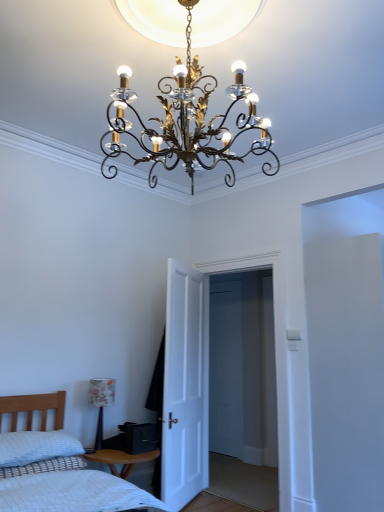
Where is `white textured pillow at lower left`? white textured pillow at lower left is located at coordinates (36, 447).

In order to click on white matte door at center in this screenshot , I will do `click(185, 387)`.

In order to click on white textured pillow at lower left in this screenshot , I will do `click(36, 447)`.

In the scene shown: Which of these two, white textured pillow at lower left or floral-patterned fabric lampshade at lower left, the 1th lamp viewed from the left, stands shorter?

Standing shorter between the two is white textured pillow at lower left.

Could you measure the distance between white textured pillow at lower left and floral-patterned fabric lampshade at lower left, the 1th lamp positioned from the back?

white textured pillow at lower left and floral-patterned fabric lampshade at lower left, the 1th lamp positioned from the back, are 56.08 centimeters apart from each other.

Is white textured pillow at lower left not near floral-patterned fabric lampshade at lower left, the 1th lamp viewed from the left?

white textured pillow at lower left is actually quite close to floral-patterned fabric lampshade at lower left, the 1th lamp viewed from the left.

The height and width of the screenshot is (512, 384). In the image, there is a floral-patterned fabric lampshade at lower left, the 1th lamp positioned from the back. What are the coordinates of `pillow below it (from a real-world perspective)` in the screenshot? It's located at (36, 447).

Is floral-patterned fabric lampshade at lower left, the 1th lamp viewed from the left, surrounded by white quilted bed at lower left?

Actually, floral-patterned fabric lampshade at lower left, the 1th lamp viewed from the left, is outside white quilted bed at lower left.

Based on the photo, considering the positions of objects white quilted bed at lower left and floral-patterned fabric lampshade at lower left, the 1th lamp positioned from the back, in the image provided, who is more to the right, white quilted bed at lower left or floral-patterned fabric lampshade at lower left, the 1th lamp positioned from the back,?

white quilted bed at lower left.

From the image's perspective, is white quilted bed at lower left on top of floral-patterned fabric lampshade at lower left, the 2th lamp in the top-to-bottom sequence?

No, from the image's perspective, white quilted bed at lower left is not on top of floral-patterned fabric lampshade at lower left, the 2th lamp in the top-to-bottom sequence.

Is white quilted bed at lower left wider than floral-patterned fabric lampshade at lower left, which is the second lamp from right to left?

Indeed, white quilted bed at lower left has a greater width compared to floral-patterned fabric lampshade at lower left, which is the second lamp from right to left.

Is white matte door at center aimed at gold metallic chandelier at center, the 1th lamp positioned from the right?

No, white matte door at center is not facing towards gold metallic chandelier at center, the 1th lamp positioned from the right.

Who is more distant, white matte door at center or gold metallic chandelier at center, marked as the second lamp in a left-to-right arrangement?

white matte door at center is further from the camera.

Between white matte door at center and gold metallic chandelier at center, marked as the second lamp in a left-to-right arrangement, which one has larger width?

Wider between the two is gold metallic chandelier at center, marked as the second lamp in a left-to-right arrangement.

Looking at this image, from a real-world perspective, is white matte door at center under gold metallic chandelier at center, which appears as the first lamp when viewed from the front?

Yes, from a real-world perspective, white matte door at center is below gold metallic chandelier at center, which appears as the first lamp when viewed from the front.

In terms of height, does white textured pillow at lower left look taller or shorter compared to white quilted bed at lower left?

Clearly, white textured pillow at lower left is shorter compared to white quilted bed at lower left.

You are a GUI agent. You are given a task and a screenshot of the screen. Output one action in this format:
    pyautogui.click(x=<x>, y=<y>)
    Task: Click on the bed on the right side of white textured pillow at lower left
    The height and width of the screenshot is (512, 384).
    Given the screenshot: What is the action you would take?
    pyautogui.click(x=72, y=492)

Which object is thinner, white textured pillow at lower left or white quilted bed at lower left?

Thinner between the two is white textured pillow at lower left.

Can you confirm if white textured pillow at lower left is positioned to the right of white quilted bed at lower left?

No.

Considering the sizes of objects floral-patterned fabric lampshade at lower left, which is the 2th lamp in front-to-back order, and white quilted bed at lower left in the image provided, who is thinner, floral-patterned fabric lampshade at lower left, which is the 2th lamp in front-to-back order, or white quilted bed at lower left?

floral-patterned fabric lampshade at lower left, which is the 2th lamp in front-to-back order.

In terms of size, does floral-patterned fabric lampshade at lower left, which is the second lamp from right to left, appear bigger or smaller than white quilted bed at lower left?

Considering their sizes, floral-patterned fabric lampshade at lower left, which is the second lamp from right to left, takes up less space than white quilted bed at lower left.

Is floral-patterned fabric lampshade at lower left, which is the 2th lamp in front-to-back order, inside or outside of white quilted bed at lower left?

floral-patterned fabric lampshade at lower left, which is the 2th lamp in front-to-back order, is spatially situated outside white quilted bed at lower left.

What are the coordinates of `the 1st lamp directly above the white quilted bed at lower left (from a real-world perspective)` in the screenshot? It's located at (101, 403).

Is white matte door at center to the left of floral-patterned fabric lampshade at lower left, the 1th lamp viewed from the left, from the viewer's perspective?

In fact, white matte door at center is to the right of floral-patterned fabric lampshade at lower left, the 1th lamp viewed from the left.

Is white matte door at center spatially inside floral-patterned fabric lampshade at lower left, which is the 2th lamp in front-to-back order, or outside of it?

The correct answer is: outside.

From a real-world perspective, which object rests below the other?

From a 3D spatial view, floral-patterned fabric lampshade at lower left, the 2th lamp in the top-to-bottom sequence, is below.

Is white matte door at center beside floral-patterned fabric lampshade at lower left, the 2th lamp in the top-to-bottom sequence?

No, white matte door at center is not touching floral-patterned fabric lampshade at lower left, the 2th lamp in the top-to-bottom sequence.

Considering the positions of objects white matte door at center and white quilted bed at lower left in the image provided, who is behind, white matte door at center or white quilted bed at lower left?

white matte door at center is further away from the camera.

Do you think white matte door at center is within white quilted bed at lower left, or outside of it?

white matte door at center exists outside the volume of white quilted bed at lower left.

Are white matte door at center and white quilted bed at lower left located far from each other?

white matte door at center is far away from white quilted bed at lower left.

Which of these two, white matte door at center or white quilted bed at lower left, is smaller?

white matte door at center is smaller.

This screenshot has height=512, width=384. What are the coordinates of `pillow in front of the floral-patterned fabric lampshade at lower left, the 1th lamp positioned from the back` in the screenshot? It's located at (36, 447).

Locate an element on the screen. This screenshot has height=512, width=384. bed beneath the floral-patterned fabric lampshade at lower left, the 1th lamp viewed from the left (from a real-world perspective) is located at coordinates (72, 492).

Looking at the image, which one is located closer to floral-patterned fabric lampshade at lower left, which is the 2th lamp in front-to-back order, white matte door at center or white textured pillow at lower left?

white textured pillow at lower left lies closer to floral-patterned fabric lampshade at lower left, which is the 2th lamp in front-to-back order, than the other object.

Which object lies nearer to the anchor point floral-patterned fabric lampshade at lower left, the 1th lamp viewed from the left, white textured pillow at lower left or white quilted bed at lower left?

white textured pillow at lower left lies closer to floral-patterned fabric lampshade at lower left, the 1th lamp viewed from the left, than the other object.

Based on their spatial positions, is floral-patterned fabric lampshade at lower left, the 1th lamp viewed from the left, or white textured pillow at lower left closer to gold metallic chandelier at center, positioned as the first lamp in top-to-bottom order?

white textured pillow at lower left is positioned closer to the anchor gold metallic chandelier at center, positioned as the first lamp in top-to-bottom order.

Looking at the image, which one is located further to gold metallic chandelier at center, which is counted as the 2th lamp, starting from the back, floral-patterned fabric lampshade at lower left, positioned as the 1th lamp in bottom-to-top order, or white matte door at center?

Based on the image, floral-patterned fabric lampshade at lower left, positioned as the 1th lamp in bottom-to-top order, appears to be further to gold metallic chandelier at center, which is counted as the 2th lamp, starting from the back.

From the picture: Looking at the image, which one is located further to white matte door at center, white textured pillow at lower left or floral-patterned fabric lampshade at lower left, positioned as the 1th lamp in bottom-to-top order?

The object further to white matte door at center is white textured pillow at lower left.

Considering their positions, is gold metallic chandelier at center, marked as the second lamp in a bottom-to-top arrangement, positioned closer to white textured pillow at lower left than floral-patterned fabric lampshade at lower left, positioned as the 1th lamp in bottom-to-top order?

floral-patterned fabric lampshade at lower left, positioned as the 1th lamp in bottom-to-top order, is positioned closer to the anchor white textured pillow at lower left.

Which object lies nearer to the anchor point floral-patterned fabric lampshade at lower left, which is the second lamp from right to left, white textured pillow at lower left or gold metallic chandelier at center, which appears as the first lamp when viewed from the front?

white textured pillow at lower left is closer to floral-patterned fabric lampshade at lower left, which is the second lamp from right to left.

Considering their positions, is gold metallic chandelier at center, marked as the second lamp in a bottom-to-top arrangement, positioned further to white textured pillow at lower left than white matte door at center?

gold metallic chandelier at center, marked as the second lamp in a bottom-to-top arrangement.

This screenshot has width=384, height=512. I want to click on lamp between gold metallic chandelier at center, the 1th lamp positioned from the right, and white textured pillow at lower left from top to bottom, so click(101, 403).

The height and width of the screenshot is (512, 384). Identify the location of lamp between white quilted bed at lower left and white matte door at center along the z-axis. (188, 90).

At what (x,y) coordinates should I click in order to perform the action: click on lamp between white quilted bed at lower left and floral-patterned fabric lampshade at lower left, the 2th lamp in the top-to-bottom sequence, from front to back. Please return your answer as a coordinate pair (x, y). Looking at the image, I should click on (188, 90).

You are a GUI agent. You are given a task and a screenshot of the screen. Output one action in this format:
    pyautogui.click(x=<x>, y=<y>)
    Task: Click on the pillow positioned between white quilted bed at lower left and floral-patterned fabric lampshade at lower left, positioned as the 1th lamp in bottom-to-top order, from near to far
    
    Given the screenshot: What is the action you would take?
    pyautogui.click(x=36, y=447)